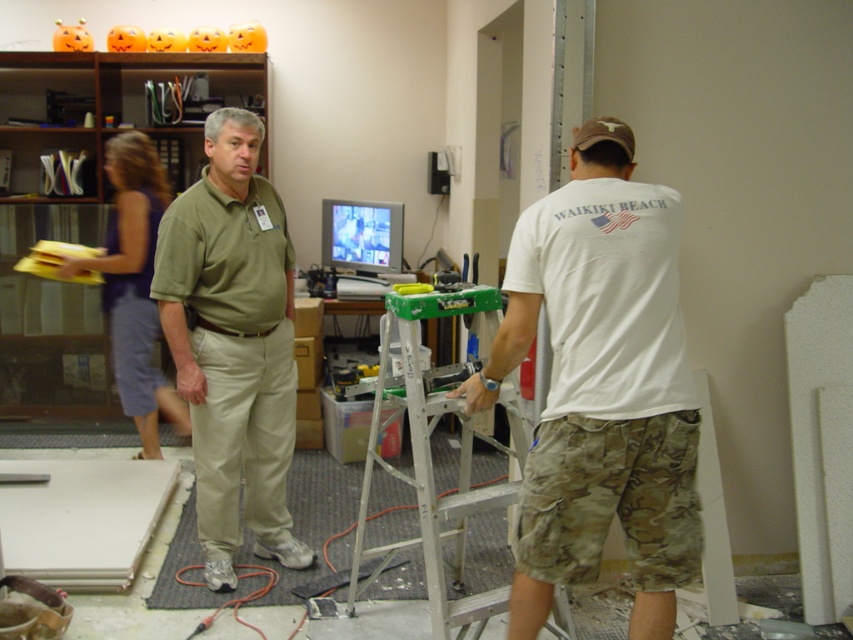
You are standing in the middle of the room and want to reach the silver metallic ladder at center. In which direction should you move to get to it?

Since the silver metallic ladder at center is located at coordinates approximately 0.706 on the x axis and 0.506 on the y axis, you should move to the right to reach it.

In the scene shown: You are organizing a safety inspection in this workspace. You need to ensure that the silver metallic ladder at center is suitable for use. Considering the size difference between the ladder and the blue denim shorts at left, what should you check first?

The silver metallic ladder at center has a larger size compared to blue denim shorts at left. Since the ladder is larger, you should first check if its height and load capacity are appropriate for the task and user requirements.